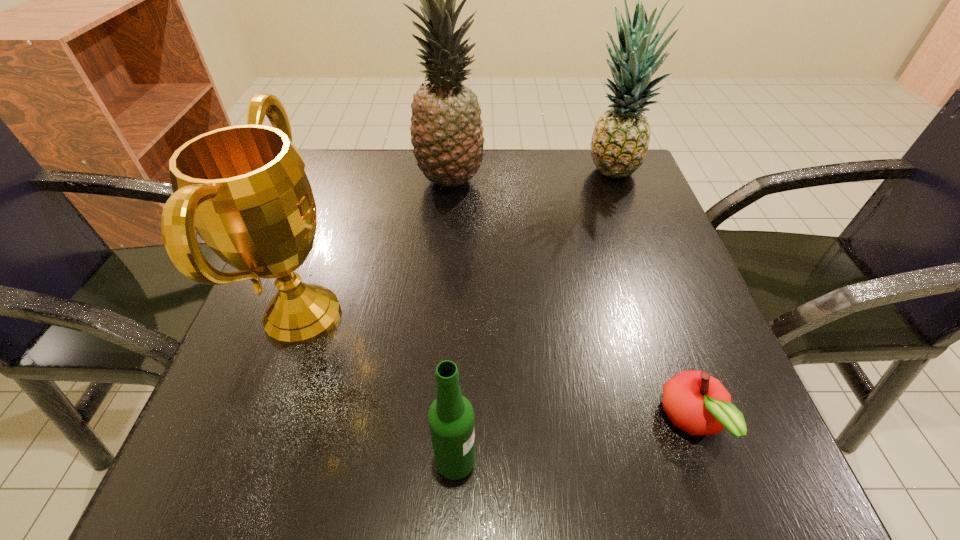
The image size is (960, 540). In the image, there is a desktop. What are the coordinates of `vacant space at the right edge` in the screenshot? It's located at (648, 275).

Locate an element on the screen. vacant space at the far right corner is located at coordinates (604, 181).

Identify the location of blank region between the fourth tallest object and the award. tap(379, 388).

I want to click on free space between the left pineapple and the right pineapple, so click(530, 177).

Image resolution: width=960 pixels, height=540 pixels. In order to click on free space between the award and the left pineapple in this screenshot , I will do `click(376, 248)`.

Where is `empty location between the left pineapple and the beer bottle`? Image resolution: width=960 pixels, height=540 pixels. empty location between the left pineapple and the beer bottle is located at coordinates (453, 320).

Identify the location of empty location between the right pineapple and the second shortest object. (533, 316).

Locate an element on the screen. The height and width of the screenshot is (540, 960). blank region between the award and the right pineapple is located at coordinates (457, 244).

Locate an element on the screen. This screenshot has height=540, width=960. empty space that is in between the left pineapple and the award is located at coordinates (376, 248).

Identify the location of blank region between the fourth tallest object and the left pineapple. (453, 320).